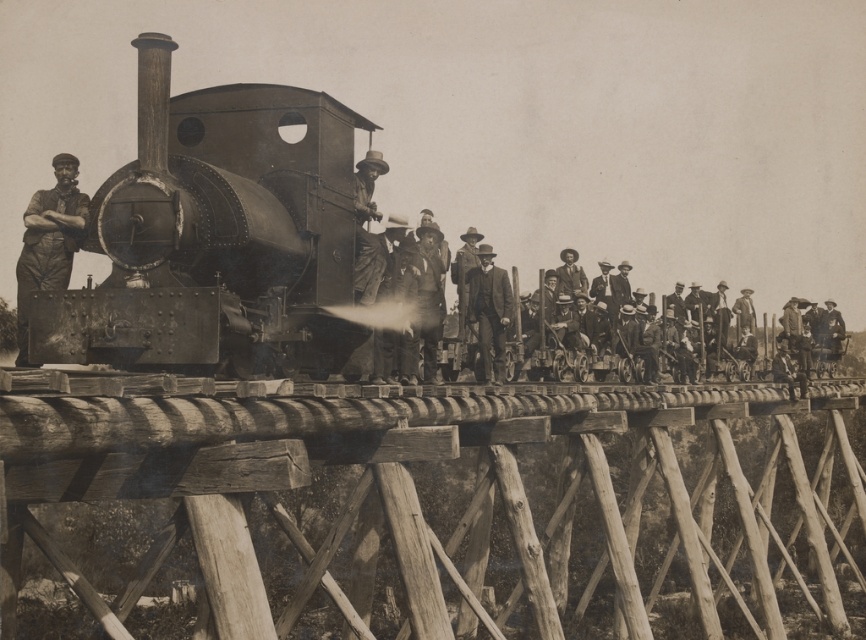
You are a photographer positioned at the center of the bridge. You want to take a photo that includes both the matte black steam locomotive at center and the smooth brown suit at center. Which object should you pan your camera to the right to include in the frame?

The smooth brown suit at center is to the right of the matte black steam locomotive at center, so you should pan your camera to the right to include the smooth brown suit at center.

You are a photographer positioned on the wooden trestle bridge. You want to capture a photo of both the polished metal locomotive at center and the matte black steam locomotive at center. Which one should you focus on first if you want to ensure both are in sharp focus?

The polished metal locomotive at center is located above the matte black steam locomotive at center. Since they are stacked vertically, focusing on the one in the front would help ensure both are in focus. However, since the description doesn t specify which is closer to the photographer, it s unclear which to focus on first. Please check the depth of field or use a focus stacking technique.

You are a photographer standing on the wooden trestle bridge where the rusty metal man at center and the smooth brown suit at center are located. You want to take a photo that includes both subjects. Given that your camera has a maximum focus range of 18 meters, will you be able to capture both subjects in focus?

The rusty metal man at center and the smooth brown suit at center are 18.11 meters apart from each other. Since the distance between them exceeds the camera maximum focus range of 18 meters, you will not be able to capture both subjects in focus.